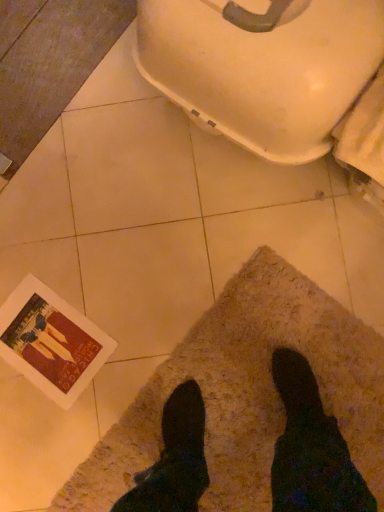
Question: Does white glossy toilet bowl at upper right contain beige shaggy mat at lower center?

Choices:
 (A) yes
 (B) no

Answer: (B)

Question: Considering the relative positions of white glossy toilet bowl at upper right and beige shaggy mat at lower center in the image provided, is white glossy toilet bowl at upper right behind beige shaggy mat at lower center?

Choices:
 (A) yes
 (B) no

Answer: (B)

Question: Is white glossy toilet bowl at upper right turned away from beige shaggy mat at lower center?

Choices:
 (A) no
 (B) yes

Answer: (A)

Question: Can you confirm if white glossy toilet bowl at upper right is taller than beige shaggy mat at lower center?

Choices:
 (A) yes
 (B) no

Answer: (A)

Question: Is white glossy toilet bowl at upper right oriented towards beige shaggy mat at lower center?

Choices:
 (A) yes
 (B) no

Answer: (B)

Question: From the image's perspective, is white glossy toilet bowl at upper right beneath beige shaggy mat at lower center?

Choices:
 (A) no
 (B) yes

Answer: (A)

Question: Can you confirm if beige shaggy mat at lower center is positioned to the left of white glossy toilet bowl at upper right?

Choices:
 (A) yes
 (B) no

Answer: (B)

Question: Does beige shaggy mat at lower center have a lesser height compared to white glossy toilet bowl at upper right?

Choices:
 (A) yes
 (B) no

Answer: (A)

Question: Is beige shaggy mat at lower center next to white glossy toilet bowl at upper right and touching it?

Choices:
 (A) no
 (B) yes

Answer: (A)

Question: Is white glossy toilet bowl at upper right completely or partially inside beige shaggy mat at lower center?

Choices:
 (A) yes
 (B) no

Answer: (B)

Question: From a real-world perspective, is beige shaggy mat at lower center positioned under white glossy toilet bowl at upper right based on gravity?

Choices:
 (A) no
 (B) yes

Answer: (B)

Question: Is beige shaggy mat at lower center further to camera compared to white glossy toilet bowl at upper right?

Choices:
 (A) no
 (B) yes

Answer: (B)

Question: Relative to white glossy toilet bowl at upper right, is beige shaggy mat at lower center in front or behind?

Choices:
 (A) front
 (B) behind

Answer: (B)